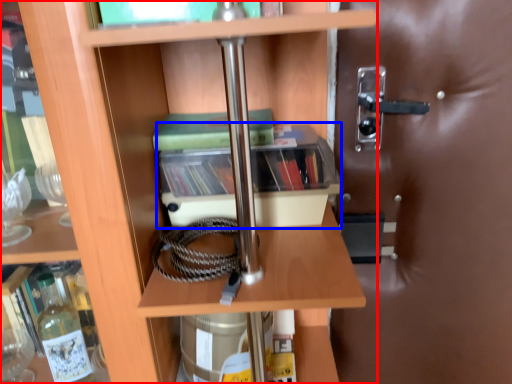
Question: Which object is closer to the camera taking this photo, shelf (highlighted by a red box) or cabinetry (highlighted by a blue box)?

Choices:
 (A) shelf
 (B) cabinetry

Answer: (A)